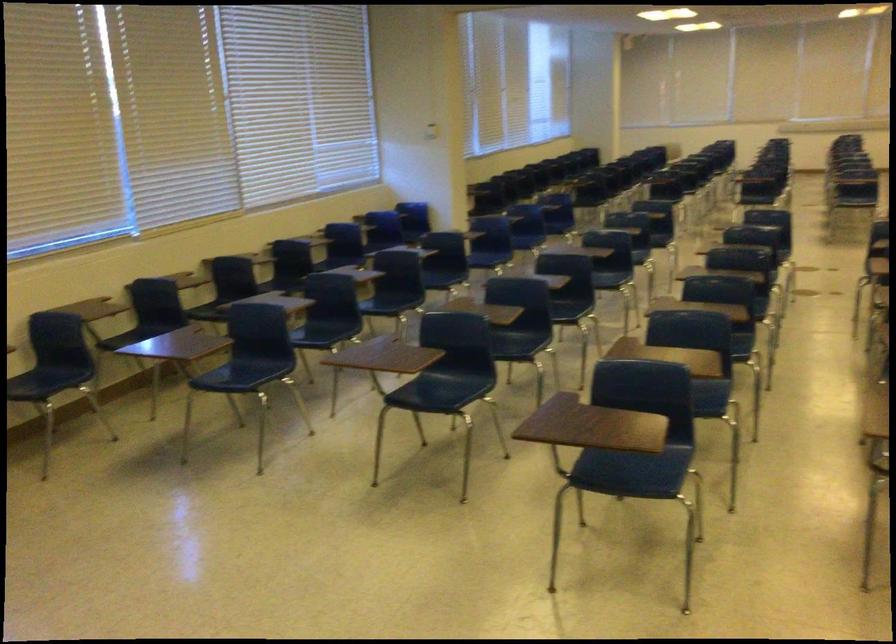
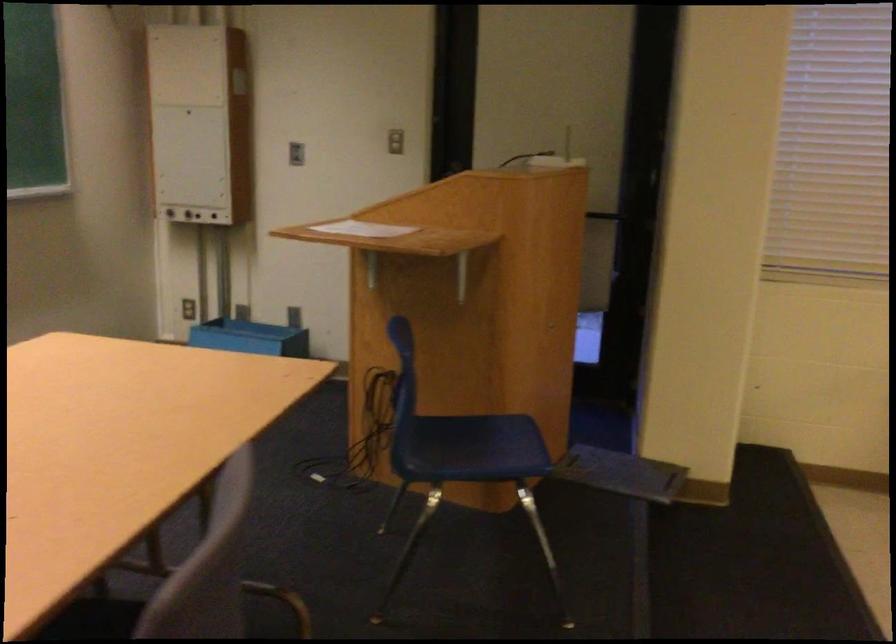
Question: The camera is either moving clockwise (left) or counter-clockwise (right) around the object. The first image is from the beginning of the video and the second image is from the end. Is the camera moving left or right when shooting the video?

Choices:
 (A) Left
 (B) Right

Answer: (B)